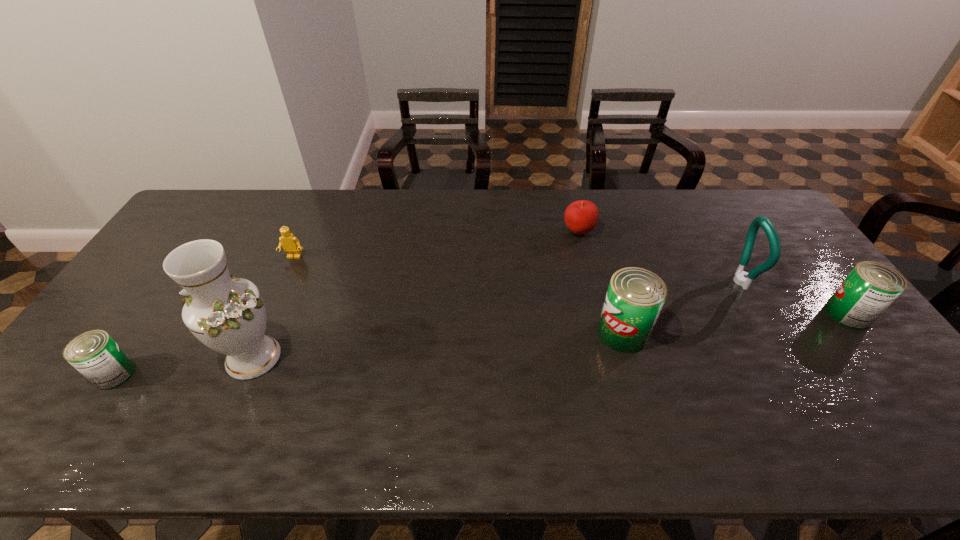
Where is `object that is the third closest to the third tallest object`? object that is the third closest to the third tallest object is located at coordinates (870, 288).

Identify which object is the fifth closest to the nearest can. Please provide its 2D coordinates. Your answer should be formatted as a tuple, i.e. [(x, y)], where the tuple contains the x and y coordinates of a point satisfying the conditions above.

[(740, 278)]

Select which can appears as the third closest to the sixth shortest object. Please provide its 2D coordinates. Your answer should be formatted as a tuple, i.e. [(x, y)], where the tuple contains the x and y coordinates of a point satisfying the conditions above.

[(94, 354)]

Locate which can is the third closest to the farthest object. Please provide its 2D coordinates. Your answer should be formatted as a tuple, i.e. [(x, y)], where the tuple contains the x and y coordinates of a point satisfying the conditions above.

[(94, 354)]

Where is `free space that satisfies the following two spatial constraints: 1. on the face of the Lego; 2. on the right side of the fifth shortest object`? This screenshot has height=540, width=960. free space that satisfies the following two spatial constraints: 1. on the face of the Lego; 2. on the right side of the fifth shortest object is located at coordinates pos(261,333).

Locate an element on the screen. free spot that satisfies the following two spatial constraints: 1. on the face of the sixth nearest object; 2. on the right side of the second can from left to right is located at coordinates (261, 333).

Where is `free space that satisfies the following two spatial constraints: 1. at the jaws of the second object from right to left; 2. on the left side of the fourth shortest object`? free space that satisfies the following two spatial constraints: 1. at the jaws of the second object from right to left; 2. on the left side of the fourth shortest object is located at coordinates (757, 314).

At what (x,y) coordinates should I click in order to perform the action: click on free space that satisfies the following two spatial constraints: 1. on the face of the rightmost can; 2. on the left side of the sixth nearest object. Please return your answer as a coordinate pair (x, y). The height and width of the screenshot is (540, 960). Looking at the image, I should click on (269, 314).